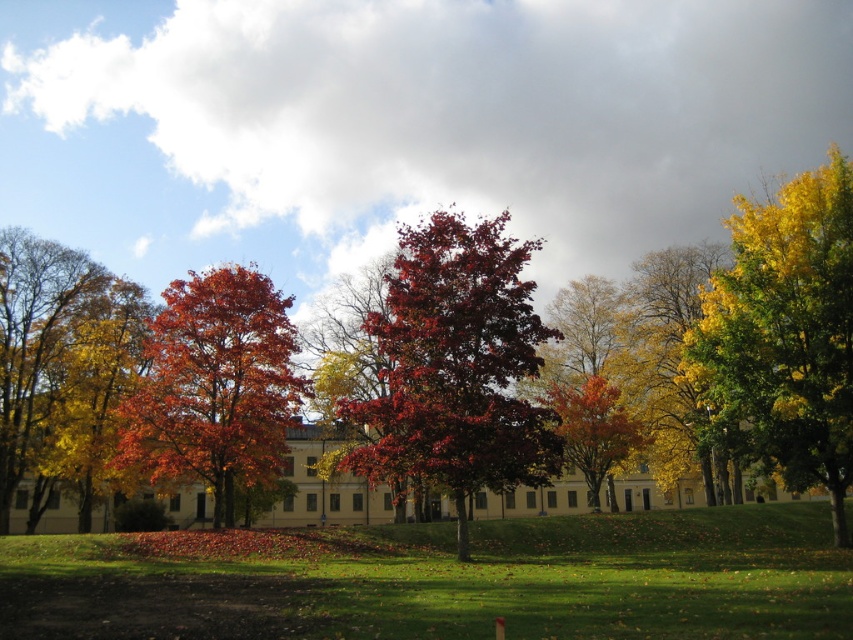
Which is behind, point (821, 428) or point (247, 340)?

The point (247, 340) is more distant.

Is point (791, 346) farther from viewer compared to point (215, 372)?

No, (791, 346) is in front of (215, 372).

You are a GUI agent. You are given a task and a screenshot of the screen. Output one action in this format:
    pyautogui.click(x=<x>, y=<y>)
    Task: Click on the yellow-green leafy tree at right
    
    Given the screenshot: What is the action you would take?
    pyautogui.click(x=787, y=332)

Does shiny red leaves at center appear under shiny crimson leaves at center?

Yes.

The width and height of the screenshot is (853, 640). I want to click on shiny red leaves at center, so click(x=752, y=342).

I want to click on shiny red leaves at center, so click(x=752, y=342).

What are the coordinates of `shiny red leaves at center` in the screenshot? It's located at (752, 342).

Is shiny crimson leaves at center above yellow-green leafy tree at right?

No.

Does shiny crimson leaves at center have a lesser height compared to yellow-green leafy tree at right?

Yes, shiny crimson leaves at center is shorter than yellow-green leafy tree at right.

Where is `shiny crimson leaves at center`? The image size is (853, 640). shiny crimson leaves at center is located at coordinates [x=456, y=365].